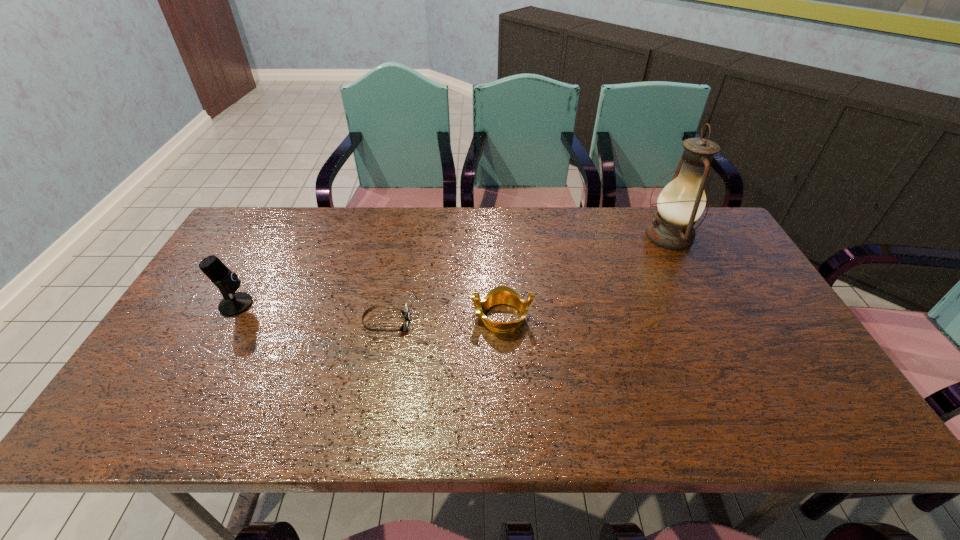
This screenshot has width=960, height=540. Identify the location of vacant space situated 0.230m at the front emblem of the tiara. (384, 317).

The image size is (960, 540). I want to click on vacant space located 0.200m at the front emblem of the tiara, so click(396, 317).

Where is `vacant space positioned 0.350m at the front emblem of the tiara`? This screenshot has height=540, width=960. vacant space positioned 0.350m at the front emblem of the tiara is located at coordinates (339, 317).

The width and height of the screenshot is (960, 540). Find the location of `vacant region located on the front-facing side of the goggles`. vacant region located on the front-facing side of the goggles is located at coordinates (459, 323).

The height and width of the screenshot is (540, 960). Find the location of `object that is positioned at the far edge`. object that is positioned at the far edge is located at coordinates (682, 201).

In order to click on object that is at the left edge in this screenshot , I will do `click(232, 304)`.

Where is `object located at the right edge`? The image size is (960, 540). object located at the right edge is located at coordinates (682, 201).

You are a GUI agent. You are given a task and a screenshot of the screen. Output one action in this format:
    pyautogui.click(x=<x>, y=<y>)
    Task: Click on the object at the far right corner
    The height and width of the screenshot is (540, 960).
    Given the screenshot: What is the action you would take?
    pyautogui.click(x=682, y=201)

At what (x,y) coordinates should I click in order to perform the action: click on vacant space at the far edge. Please return your answer as a coordinate pair (x, y). Looking at the image, I should click on (320, 226).

Find the location of a particular element. The height and width of the screenshot is (540, 960). vacant space at the near edge of the desktop is located at coordinates (565, 408).